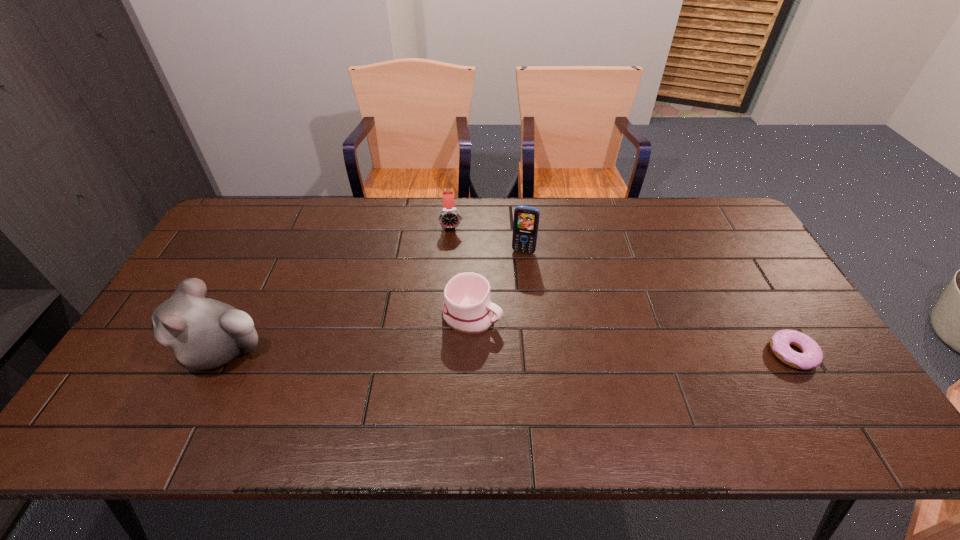
This screenshot has height=540, width=960. I want to click on vacant area that lies between the rightmost object and the hamster, so click(x=508, y=352).

Locate an element on the screen. This screenshot has height=540, width=960. vacant space that is in between the hamster and the fourth object from left to right is located at coordinates click(373, 301).

The image size is (960, 540). I want to click on unoccupied area between the mug and the watch, so click(x=462, y=269).

You are a GUI agent. You are given a task and a screenshot of the screen. Output one action in this format:
    pyautogui.click(x=<x>, y=<y>)
    Task: Click on the free area in between the fourth object from left to right and the hamster
    
    Given the screenshot: What is the action you would take?
    pyautogui.click(x=373, y=301)

The image size is (960, 540). Identify the location of vacant region between the second object from right to left and the shortest object. (658, 302).

You are a GUI agent. You are given a task and a screenshot of the screen. Output one action in this format:
    pyautogui.click(x=<x>, y=<y>)
    Task: Click on the free space between the mug and the hamster
    
    Given the screenshot: What is the action you would take?
    (348, 333)

Find the location of a particular element. empty location between the doughnut and the leftmost object is located at coordinates (508, 352).

This screenshot has height=540, width=960. In order to click on free space between the mug and the hamster in this screenshot , I will do `click(348, 333)`.

This screenshot has width=960, height=540. What are the coordinates of `empty space that is in between the doughnut and the watch` in the screenshot? It's located at (622, 288).

Where is `free point between the hamster and the mug`? This screenshot has width=960, height=540. free point between the hamster and the mug is located at coordinates (348, 333).